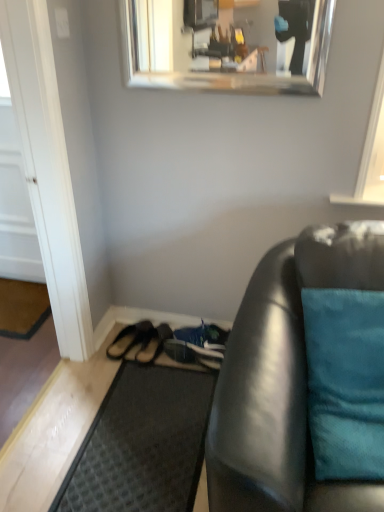
Question: Is white glossy door at left at the right side of black rubber doormat at lower center, which is the second doormat from top to bottom?

Choices:
 (A) no
 (B) yes

Answer: (A)

Question: Is white glossy door at left further to camera compared to black rubber doormat at lower center, which is the first doormat in bottom-to-top order?

Choices:
 (A) no
 (B) yes

Answer: (B)

Question: Is white glossy door at left facing away from black rubber doormat at lower center, which is the second doormat from top to bottom?

Choices:
 (A) yes
 (B) no

Answer: (B)

Question: From a real-world perspective, is white glossy door at left physically above black rubber doormat at lower center, which is the 1th doormat from front to back?

Choices:
 (A) yes
 (B) no

Answer: (A)

Question: Is white glossy door at left at the left side of black rubber doormat at lower center, which is the 1th doormat from front to back?

Choices:
 (A) no
 (B) yes

Answer: (B)

Question: Based on their positions, is teal fabric pillow at right located to the left or right of white wood door at lower left?

Choices:
 (A) left
 (B) right

Answer: (B)

Question: Do you think teal fabric pillow at right is within white wood door at lower left, or outside of it?

Choices:
 (A) outside
 (B) inside

Answer: (A)

Question: Does point (354, 435) appear closer or farther from the camera than point (36, 96)?

Choices:
 (A) farther
 (B) closer

Answer: (B)

Question: Is teal fabric pillow at right bigger or smaller than white wood door at lower left?

Choices:
 (A) small
 (B) big

Answer: (A)

Question: Is white glossy door at left inside or outside of dark gray textured mat at left, which is counted as the second doormat, starting from the right?

Choices:
 (A) inside
 (B) outside

Answer: (B)

Question: In the image, is white glossy door at left positioned in front of or behind dark gray textured mat at left, which is the 2th doormat from front to back?

Choices:
 (A) front
 (B) behind

Answer: (A)

Question: From a real-world perspective, is white glossy door at left above or below dark gray textured mat at left, which is counted as the second doormat, starting from the right?

Choices:
 (A) above
 (B) below

Answer: (A)

Question: Considering the relative positions of white glossy door at left and dark gray textured mat at left, the first doormat viewed from the back, in the image provided, is white glossy door at left to the left or to the right of dark gray textured mat at left, the first doormat viewed from the back,?

Choices:
 (A) left
 (B) right

Answer: (A)

Question: Would you say teal fabric pillow at right is to the left or to the right of brown suede sandals at lower center, acting as the 1th footwear starting from the right, in the picture?

Choices:
 (A) right
 (B) left

Answer: (A)

Question: Relative to brown suede sandals at lower center, arranged as the second footwear when viewed from the left, is teal fabric pillow at right in front or behind?

Choices:
 (A) front
 (B) behind

Answer: (A)